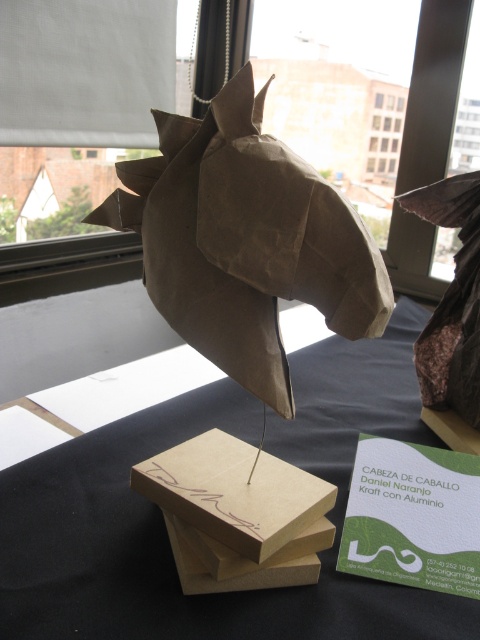
Question: Which of the following is the closest to the observer?

Choices:
 (A) (170, 164)
 (B) (405, 257)

Answer: (A)

Question: Estimate the real-world distances between objects in this image. Which object is closer to the matte brown paper at center?

Choices:
 (A) green kraft at center
 (B) brown kraft at center
 (C) brown kraft paper horse head at center

Answer: (A)

Question: Considering the relative positions of green kraft at center and brown kraft at center in the image provided, where is green kraft at center located with respect to brown kraft at center?

Choices:
 (A) above
 (B) below

Answer: (B)

Question: Based on their relative distances, which object is nearer to the green kraft at center?

Choices:
 (A) brown kraft paper horse head at center
 (B) matte brown paper at center

Answer: (B)

Question: Is brown paper horse head at upper center bigger than brown kraft at center?

Choices:
 (A) yes
 (B) no

Answer: (A)

Question: Is green kraft at center bigger than brown kraft at center?

Choices:
 (A) no
 (B) yes

Answer: (B)